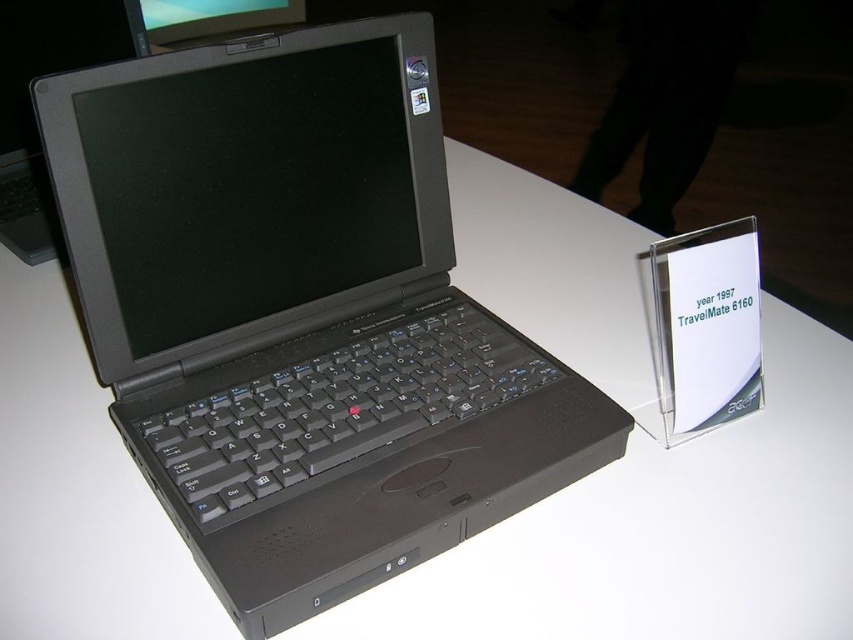
Question: Is matte black laptop at center below black matte laptop at center?

Choices:
 (A) yes
 (B) no

Answer: (A)

Question: Does matte black laptop at center come in front of black matte laptop at center?

Choices:
 (A) yes
 (B) no

Answer: (A)

Question: Among these points, which one is nearest to the camera?

Choices:
 (A) (22, 10)
 (B) (358, 356)

Answer: (B)

Question: Which point appears farthest from the camera in this image?

Choices:
 (A) (48, 193)
 (B) (212, 145)

Answer: (A)

Question: Can you confirm if matte black laptop at center is positioned to the left of black matte laptop at center?

Choices:
 (A) yes
 (B) no

Answer: (B)